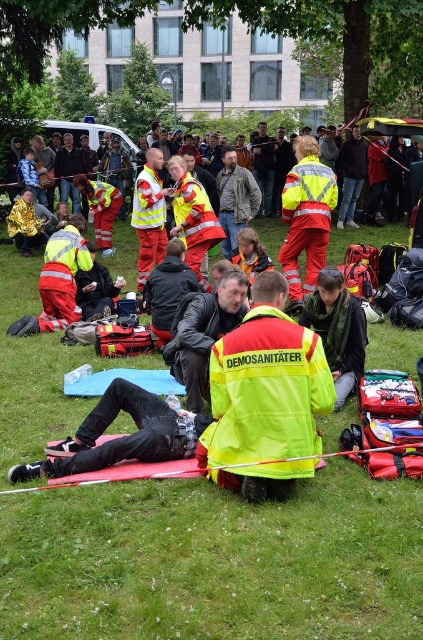
Question: Considering the real-world distances, which object is closest to the green grass at center?

Choices:
 (A) leather jacket at center
 (B) high-visibility reflective jacket at center

Answer: (B)

Question: Which point is farther from the camera taking this photo?

Choices:
 (A) (282, 428)
 (B) (51, 531)

Answer: (A)

Question: Considering the relative positions of high-visibility reflective jacket at center and leather jacket at center in the image provided, where is high-visibility reflective jacket at center located with respect to leather jacket at center?

Choices:
 (A) left
 (B) right

Answer: (B)

Question: Can you confirm if high-visibility reflective jacket at center is bigger than leather jacket at center?

Choices:
 (A) yes
 (B) no

Answer: (B)

Question: Which point is farther from the camera taking this photo?

Choices:
 (A) (246, 220)
 (B) (395, 627)

Answer: (A)

Question: Does green grass at center appear on the right side of leather jacket at center?

Choices:
 (A) no
 (B) yes

Answer: (A)